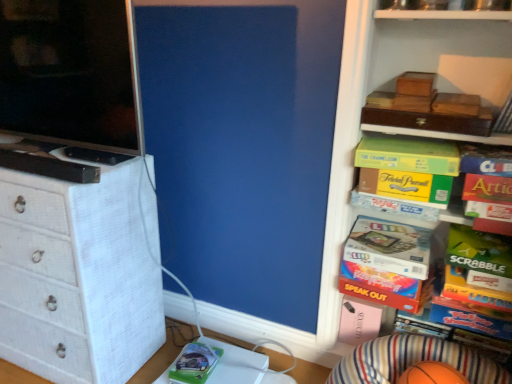
Question: From the image's perspective, is orange rubber basketball at lower right located above green matte comic book at lower center?

Choices:
 (A) yes
 (B) no

Answer: (B)

Question: Does orange rubber basketball at lower right come behind green matte comic book at lower center?

Choices:
 (A) no
 (B) yes

Answer: (A)

Question: From a real-world perspective, does orange rubber basketball at lower right stand above green matte comic book at lower center?

Choices:
 (A) no
 (B) yes

Answer: (B)

Question: Is orange rubber basketball at lower right positioned far away from green matte comic book at lower center?

Choices:
 (A) yes
 (B) no

Answer: (B)

Question: Can you confirm if orange rubber basketball at lower right is thinner than green matte comic book at lower center?

Choices:
 (A) no
 (B) yes

Answer: (A)

Question: Could green matte comic book at lower center be considered to be inside orange rubber basketball at lower right?

Choices:
 (A) yes
 (B) no

Answer: (B)

Question: Is multicolored cardboard game at center right, which is counted as the fifth book, starting from the top, thinner than green cardboard game at upper right, the fourth book positioned from the bottom?

Choices:
 (A) no
 (B) yes

Answer: (B)

Question: Does multicolored cardboard game at center right, which is counted as the fifth book, starting from the top, have a smaller size compared to green cardboard game at upper right, placed as the second book when sorted from top to bottom?

Choices:
 (A) yes
 (B) no

Answer: (A)

Question: From the image's perspective, is multicolored cardboard game at center right, which is counted as the 1th book, starting from the bottom, beneath green cardboard game at upper right, the fourth book positioned from the bottom?

Choices:
 (A) no
 (B) yes

Answer: (B)

Question: Is multicolored cardboard game at center right, which is counted as the fifth book, starting from the top, shorter than green cardboard game at upper right, placed as the second book when sorted from top to bottom?

Choices:
 (A) yes
 (B) no

Answer: (B)

Question: Is multicolored cardboard game at center right, which is counted as the fifth book, starting from the top, not within green cardboard game at upper right, the fourth book positioned from the bottom?

Choices:
 (A) yes
 (B) no

Answer: (A)

Question: Considering the relative sizes of multicolored cardboard game at center right, which is counted as the fifth book, starting from the top, and green cardboard game at upper right, the fourth book positioned from the bottom, in the image provided, is multicolored cardboard game at center right, which is counted as the fifth book, starting from the top, wider than green cardboard game at upper right, the fourth book positioned from the bottom,?

Choices:
 (A) no
 (B) yes

Answer: (A)

Question: Can you confirm if orange rubber basketball at lower right is wider than wooden boxes at upper right?

Choices:
 (A) yes
 (B) no

Answer: (A)